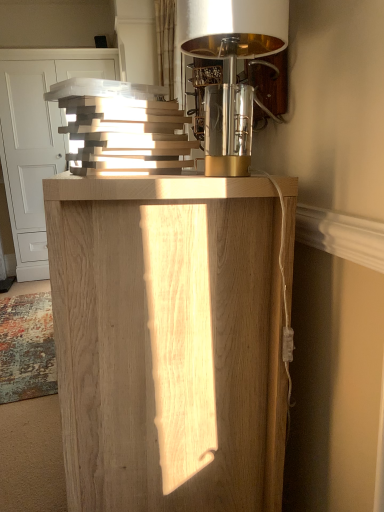
Question: Does natural wood cabinet at center have a larger size compared to polished brass lampshade at upper right?

Choices:
 (A) no
 (B) yes

Answer: (B)

Question: From a real-world perspective, is natural wood cabinet at center below polished brass lampshade at upper right?

Choices:
 (A) no
 (B) yes

Answer: (B)

Question: Could you tell me if natural wood cabinet at center is facing polished brass lampshade at upper right?

Choices:
 (A) yes
 (B) no

Answer: (B)

Question: Is natural wood cabinet at center facing away from polished brass lampshade at upper right?

Choices:
 (A) yes
 (B) no

Answer: (B)

Question: Can you confirm if natural wood cabinet at center is positioned to the left of polished brass lampshade at upper right?

Choices:
 (A) yes
 (B) no

Answer: (A)

Question: Do you think natural wood cabinet at upper left is within natural wood cabinet at center, or outside of it?

Choices:
 (A) inside
 (B) outside

Answer: (B)

Question: Considering the positions of natural wood cabinet at upper left and natural wood cabinet at center in the image, is natural wood cabinet at upper left bigger or smaller than natural wood cabinet at center?

Choices:
 (A) big
 (B) small

Answer: (A)

Question: From a real-world perspective, relative to natural wood cabinet at center, is natural wood cabinet at upper left vertically above or below?

Choices:
 (A) below
 (B) above

Answer: (B)

Question: In terms of height, does natural wood cabinet at upper left look taller or shorter compared to natural wood cabinet at center?

Choices:
 (A) short
 (B) tall

Answer: (B)

Question: From their relative heights in the image, would you say polished brass lampshade at upper right is taller or shorter than natural wood cabinet at center?

Choices:
 (A) short
 (B) tall

Answer: (A)

Question: In terms of width, does polished brass lampshade at upper right look wider or thinner when compared to natural wood cabinet at center?

Choices:
 (A) thin
 (B) wide

Answer: (A)

Question: Is polished brass lampshade at upper right in front of or behind natural wood cabinet at center in the image?

Choices:
 (A) front
 (B) behind

Answer: (B)

Question: In terms of size, does polished brass lampshade at upper right appear bigger or smaller than natural wood cabinet at center?

Choices:
 (A) big
 (B) small

Answer: (B)

Question: Considering the positions of natural wood cabinet at center and polished brass lampshade at upper right in the image, is natural wood cabinet at center taller or shorter than polished brass lampshade at upper right?

Choices:
 (A) short
 (B) tall

Answer: (B)

Question: From the image's perspective, is natural wood cabinet at center located above or below polished brass lampshade at upper right?

Choices:
 (A) below
 (B) above

Answer: (A)